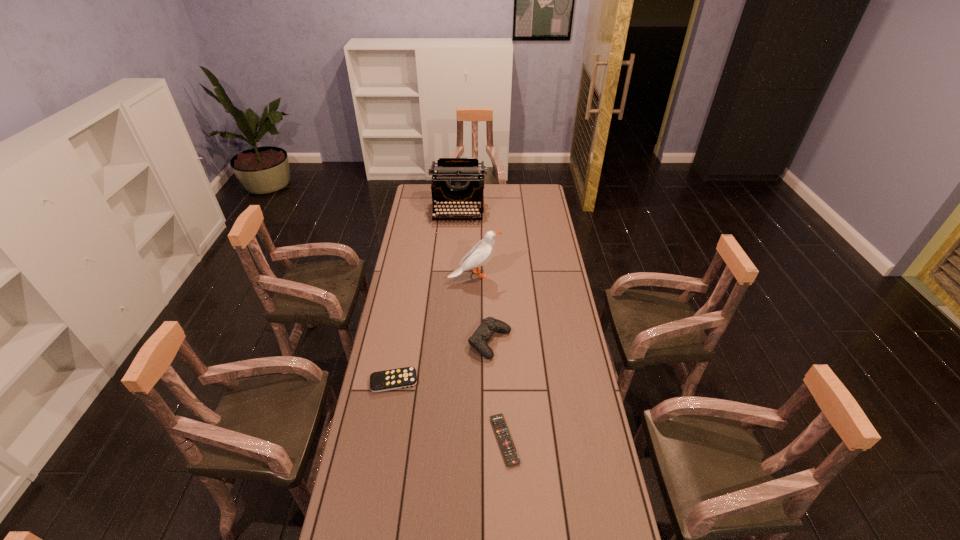
I want to click on the farthest object, so click(x=454, y=180).

Identify the location of the second farthest object. (483, 251).

Image resolution: width=960 pixels, height=540 pixels. I want to click on the third nearest object, so 489,325.

At what (x,y) coordinates should I click in order to perform the action: click on the third shortest object. Please return your answer as a coordinate pair (x, y). Looking at the image, I should click on (489, 325).

You are a GUI agent. You are given a task and a screenshot of the screen. Output one action in this format:
    pyautogui.click(x=<x>, y=<y>)
    Task: Click on the farther remote control
    
    Given the screenshot: What is the action you would take?
    pyautogui.click(x=380, y=381)

The width and height of the screenshot is (960, 540). In order to click on the taller remote control in this screenshot , I will do `click(380, 381)`.

Where is `the nearest object`? the nearest object is located at coordinates (505, 440).

Identify the location of the shortest object. The image size is (960, 540). (505, 440).

Image resolution: width=960 pixels, height=540 pixels. I want to click on vacant point located 0.060m on the typing side of the farthest object, so click(457, 231).

At what (x,y) coordinates should I click in order to perform the action: click on free region located 0.260m at the beak of the second farthest object. Please return your answer as a coordinate pair (x, y). The image size is (960, 540). Looking at the image, I should click on [x=555, y=275].